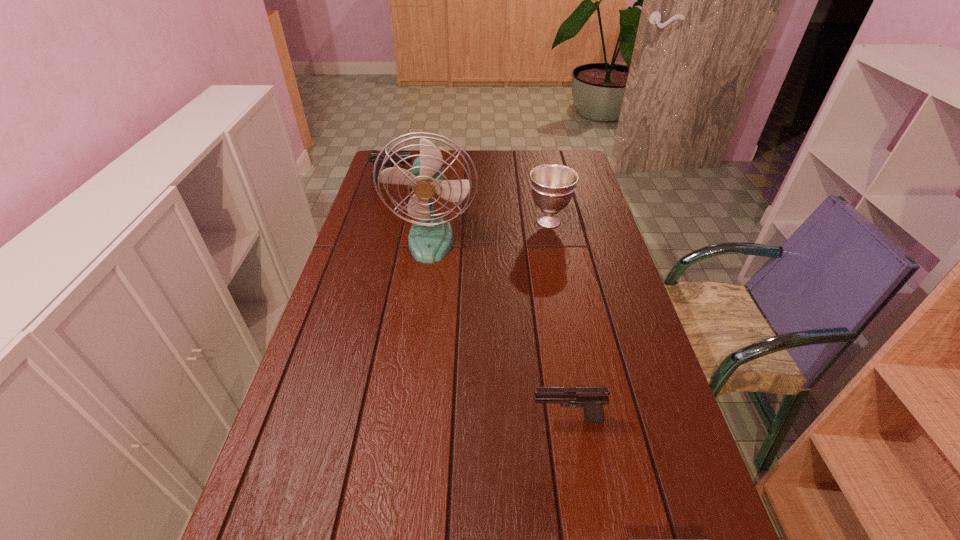
You are a GUI agent. You are given a task and a screenshot of the screen. Output one action in this format:
    pyautogui.click(x=<x>, y=<y>)
    Task: Click on the free spot between the chalice and the second nearest object
    
    Given the screenshot: What is the action you would take?
    pyautogui.click(x=558, y=320)

What are the coordinates of `free space between the fourth shortest object and the farthest pistol` in the screenshot? It's located at (470, 201).

Where is `object that can be found as the fourth closest to the shortest pistol`? object that can be found as the fourth closest to the shortest pistol is located at coordinates (373, 156).

I want to click on object that is the second closest to the second tallest object, so click(x=373, y=156).

Where is `the closest pistol to the second nearest object`? This screenshot has height=540, width=960. the closest pistol to the second nearest object is located at coordinates (629, 539).

Identify which pistol is the second closest to the fourth shortest object. Please provide its 2D coordinates. Your answer should be formatted as a tuple, i.e. [(x, y)], where the tuple contains the x and y coordinates of a point satisfying the conditions above.

[(592, 399)]

Where is `vacant space that satisfies the following two spatial constraints: 1. at the barrel of the chalice; 2. on the right side of the leftmost pistol`? vacant space that satisfies the following two spatial constraints: 1. at the barrel of the chalice; 2. on the right side of the leftmost pistol is located at coordinates (381, 221).